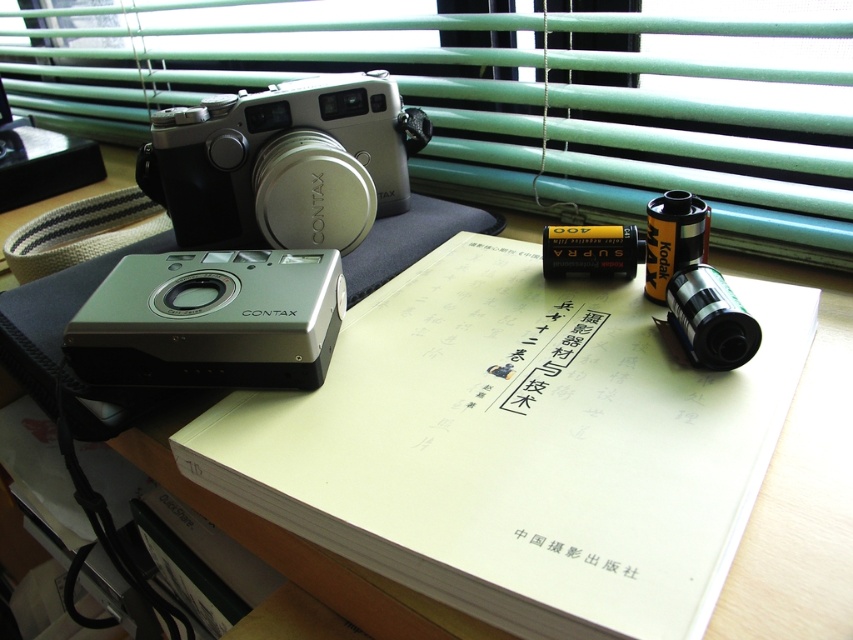
You are a photographer setting up equipment on the wooden desk. You need to move the silver metallic camera at lower left closer to the green matte blinds at upper center. However, there is an obstacle blocking the path. What is the obstacle?

The obstacle is the green matte blinds at upper center, as the silver metallic camera at lower left is behind it, meaning the blinds are in front of the camera and blocking the path.

You are a photographer setting up equipment on the desk. You need to place a small tripod between the green matte blinds at upper center and the silver metallic camera at lower left. Can you fit it there?

The green matte blinds at upper center is located above the silver metallic camera at lower left, so there is vertical space between them. However, since the blinds are at the upper part and the camera is lower, the horizontal distance might be sufficient to place the tripod between them if there is enough space along the desk.